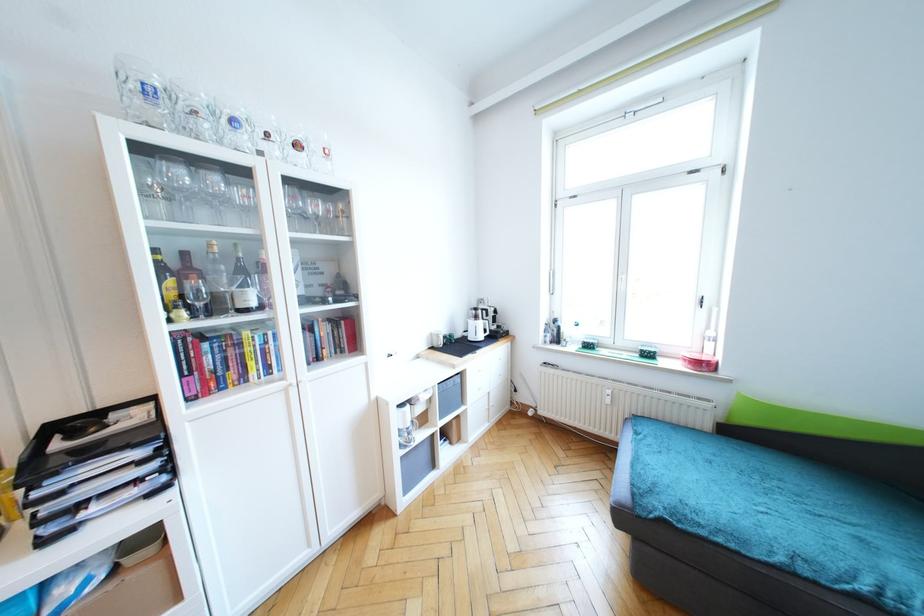
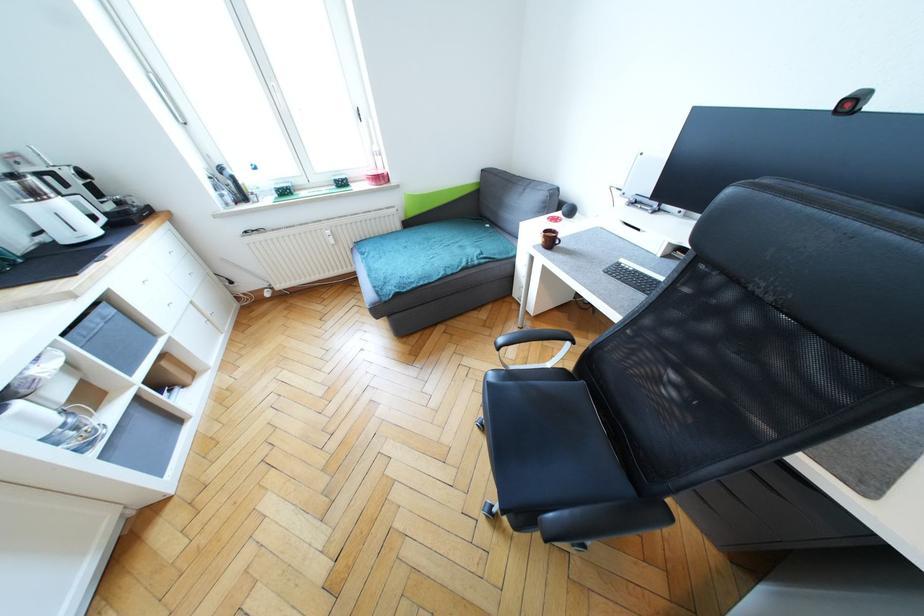
Where in the second image is the point corresponding to [416,423] from the first image?

(67, 413)